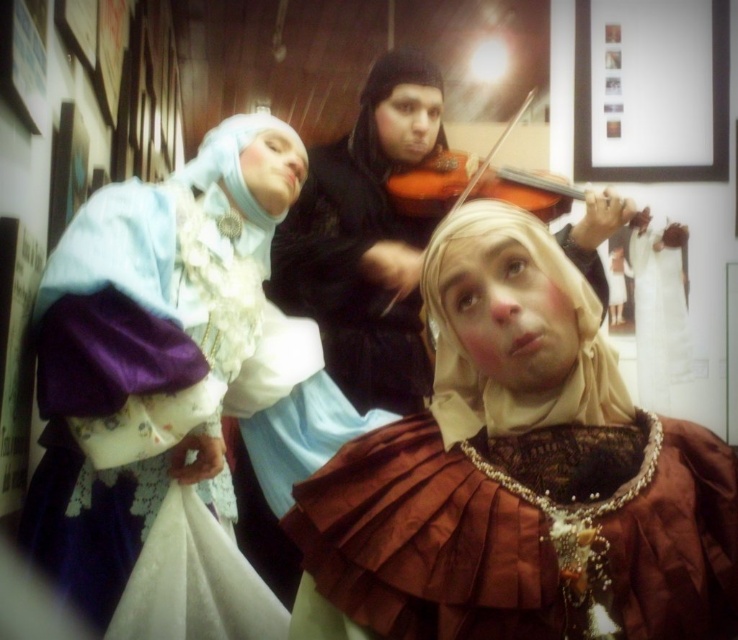
You are a costume designer preparing for a play. You have a matte blue fabric dress at left and a wooden violin at center. Which item takes up more horizontal space?

The wooden violin at center takes up more horizontal space than the matte blue fabric dress at left because its width is greater.

You are a photographer setting up for a group photo. You need to ensure that the brown satin dress at center and the matte blue fabric dress at left are both visible in the frame. Based on their heights, which dress should be placed closer to the camera to ensure both are fully visible?

The brown satin dress at center is shorter than the matte blue fabric dress at left, so placing the brown satin dress at center closer to the camera will ensure both are fully visible.